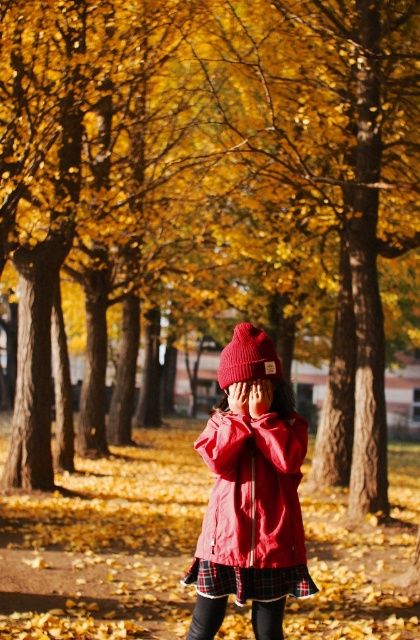
Is point (259, 349) closer to camera compared to point (265, 528)?

No, (259, 349) is further to viewer.

Can you confirm if matte red coat at center is positioned to the right of matte red jacket at center?

No, matte red coat at center is not to the right of matte red jacket at center.

Is point (285, 540) positioned behind point (293, 560)?

No, (285, 540) is closer to viewer.

The image size is (420, 640). In order to click on matte red coat at center in this screenshot , I will do pos(251,493).

From the picture: Which is below, matte red coat at center or knitted woolen beanie at center?

matte red coat at center

Measure the distance between matte red coat at center and camera.

They are 5.60 meters apart.

Does point (270, 396) come closer to viewer compared to point (239, 326)?

Yes, it is.

At what (x,y) coordinates should I click in order to perform the action: click on matte red coat at center. Please return your answer as a coordinate pair (x, y). The image size is (420, 640). Looking at the image, I should click on (251, 493).

You are a GUI agent. You are given a task and a screenshot of the screen. Output one action in this format:
    pyautogui.click(x=<x>, y=<y>)
    Task: Click on the matte red jacket at center
    Image resolution: width=420 pixels, height=640 pixels.
    Given the screenshot: What is the action you would take?
    pyautogui.click(x=252, y=490)

This screenshot has width=420, height=640. What are the coordinates of `matte red jacket at center` in the screenshot? It's located at (252, 490).